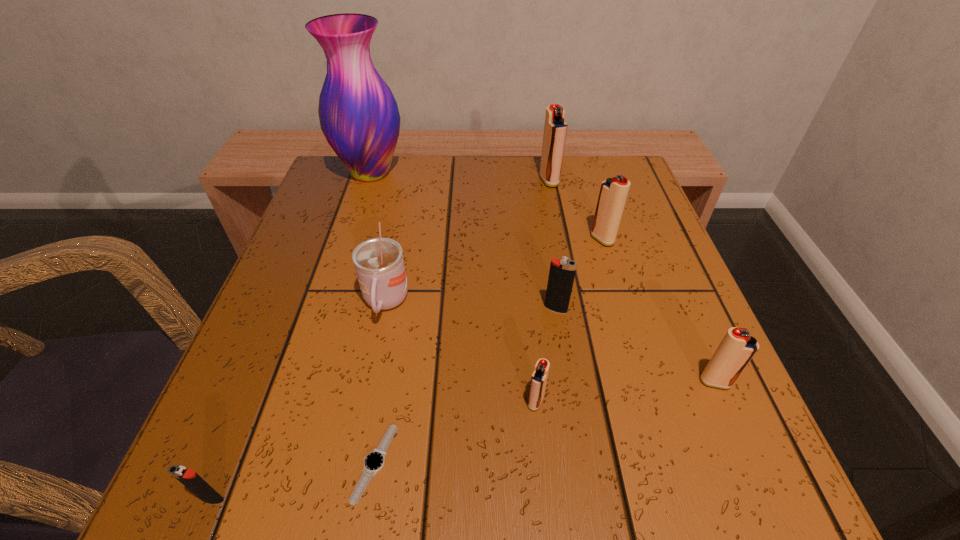
Find the location of a particular element. The height and width of the screenshot is (540, 960). object that is the third closest to the cup is located at coordinates (562, 272).

This screenshot has height=540, width=960. I want to click on the second closest object to the second igniter from left to right, so click(374, 461).

Find the location of a particular element. The width and height of the screenshot is (960, 540). igniter that is the closest to the watch is located at coordinates (189, 478).

Identify which igniter is the nearest to the second smallest red igniter. Please provide its 2D coordinates. Your answer should be formatted as a tuple, i.e. [(x, y)], where the tuple contains the x and y coordinates of a point satisfying the conditions above.

[(562, 272)]

Locate which red igniter is the fourth closest to the bigger black igniter. Please provide its 2D coordinates. Your answer should be formatted as a tuple, i.e. [(x, y)], where the tuple contains the x and y coordinates of a point satisfying the conditions above.

[(555, 128)]

Identify which red igniter is the nearest to the third red igniter from left to right. Please provide its 2D coordinates. Your answer should be formatted as a tuple, i.e. [(x, y)], where the tuple contains the x and y coordinates of a point satisfying the conditions above.

[(555, 128)]

I want to click on vacant space that satisfies the following two spatial constraints: 1. on the side with the handle of the fourth nearest object; 2. on the left side of the cup, so click(x=370, y=382).

The width and height of the screenshot is (960, 540). Find the location of `free space that satisfies the following two spatial constraints: 1. on the back side of the second smallest red igniter; 2. on the left side of the watch`. free space that satisfies the following two spatial constraints: 1. on the back side of the second smallest red igniter; 2. on the left side of the watch is located at coordinates pos(389,382).

Where is `free space that satisfies the following two spatial constraints: 1. on the side with the handle of the cup; 2. on the left side of the fifth igniter from right to left`? The image size is (960, 540). free space that satisfies the following two spatial constraints: 1. on the side with the handle of the cup; 2. on the left side of the fifth igniter from right to left is located at coordinates (366, 402).

This screenshot has width=960, height=540. I want to click on free point that satisfies the following two spatial constraints: 1. on the back side of the nearest igniter; 2. on the right side of the eighth shortest object, so click(x=341, y=180).